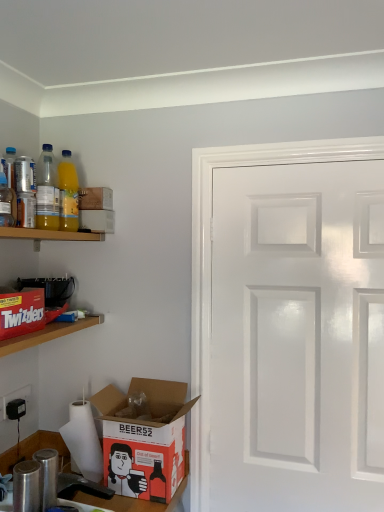
Locate an element on the screen. Image resolution: width=384 pixels, height=512 pixels. free space above white glossy door at right (from a real-world perspective) is located at coordinates (307, 158).